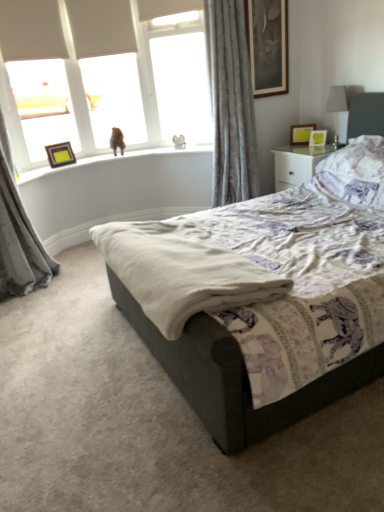
Question: Is matte white frame at upper left bigger or smaller than velvet grey bed at center?

Choices:
 (A) big
 (B) small

Answer: (B)

Question: Is matte white frame at upper left spatially inside velvet grey bed at center, or outside of it?

Choices:
 (A) outside
 (B) inside

Answer: (A)

Question: Estimate the real-world distances between objects in this image. Which object is farther from the gray velvet curtain at upper right, which ranks as the second curtain in left-to-right order?

Choices:
 (A) purple floral pillow at upper right
 (B) wooden-framed picture at upper right, which is the 3th picture frame from right to left
 (C) matte yellow picture frame at upper right, the third picture frame in the bottom-to-top sequence
 (D) white plastic window screen at upper center
 (E) matte yellow picture frame at upper right, marked as the first picture frame in a right-to-left arrangement

Answer: (A)

Question: Estimate the real-world distances between objects in this image. Which object is farther from the gray velvet curtain at upper right, arranged as the 1th curtain when viewed from the right?

Choices:
 (A) matte yellow picture frame at upper right, the 4th picture frame from the left
 (B) matte yellow picture frame at upper right, positioned as the 2th picture frame in top-to-bottom order
 (C) white plastic window screen at upper center
 (D) matte white frame at upper left
 (E) purple floral pillow at upper right

Answer: (D)